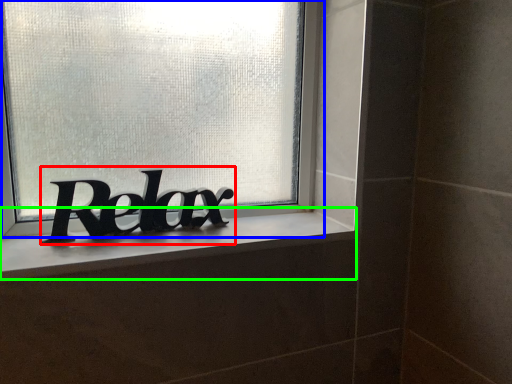
Question: Which is nearer to the lettering (highlighted by a red box)? window (highlighted by a blue box) or window sill (highlighted by a green box).

Choices:
 (A) window
 (B) window sill

Answer: (B)